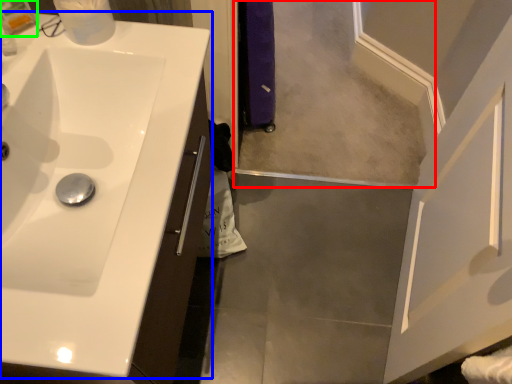
Question: Which is farther away from mirror (highlighted by a red box)? sink (highlighted by a blue box) or toiletry (highlighted by a green box)?

Choices:
 (A) sink
 (B) toiletry

Answer: (B)